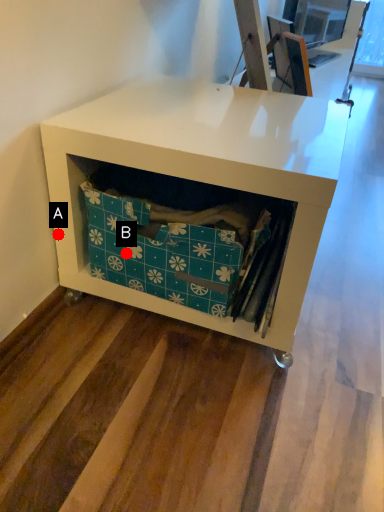
Question: Two points are circled on the image, labeled by A and B beside each circle. Which point appears closest to the camera in this image?

Choices:
 (A) A is closer
 (B) B is closer

Answer: (B)